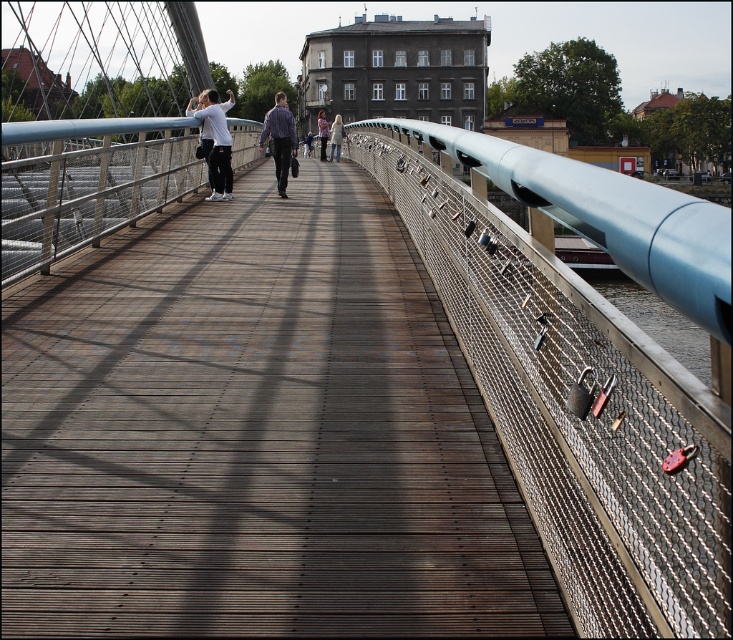
You are a photographer standing on the bridge and want to capture both the white shirt at left and the light blue fabric dress at center in a single frame. Which clothing item should you focus on first to ensure both are in the frame?

You should focus on the light blue fabric dress at center first because it is larger than the white shirt at left, allowing you to position it properly while still including the smaller white shirt at left in the frame.

You are a photographer standing on the wooden planks at center and the light blue fabric dress at center is in your view. Which object is taller when compared to the other?

The light blue fabric dress at center is taller than the wooden planks at center.

You are standing on the pedestrian bridge and want to place a decorative item exactly at the center of the wooden planks at center. According to the coordinates provided, where should you place it?

The wooden planks at center are located at point (257,435), so you should place the decorative item at those coordinates.